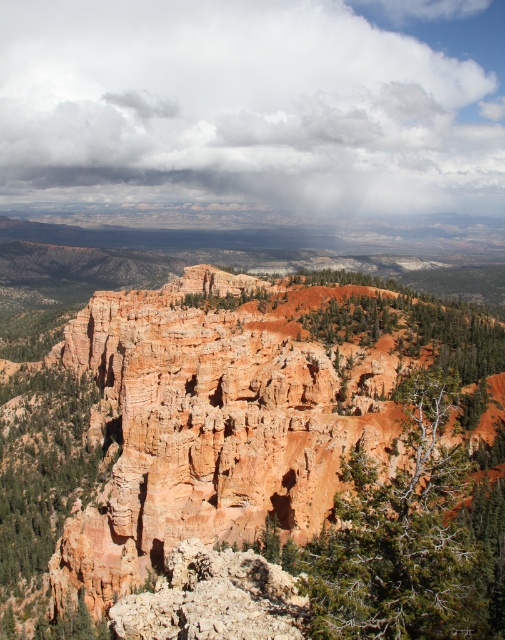
You are a hiker standing at the edge of the canyon looking at the green textured tree at center and the green textured rock at left. Which object is closer to your right side?

The green textured tree at center is closer to your right side because it is positioned to the right of the green textured rock at left.

You are a hiker standing in the rugged red rock landscape. You notice a green textured tree at center and a rusty rock formation at center. Which object is taller?

The green textured tree at center is much taller than the rusty rock formation at center.